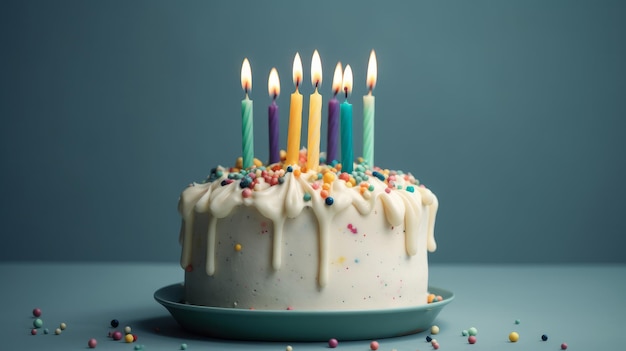
Find the location of `birthday candle`. birthday candle is located at coordinates (249, 123), (275, 124), (292, 124), (315, 130), (332, 134), (345, 133), (372, 130).